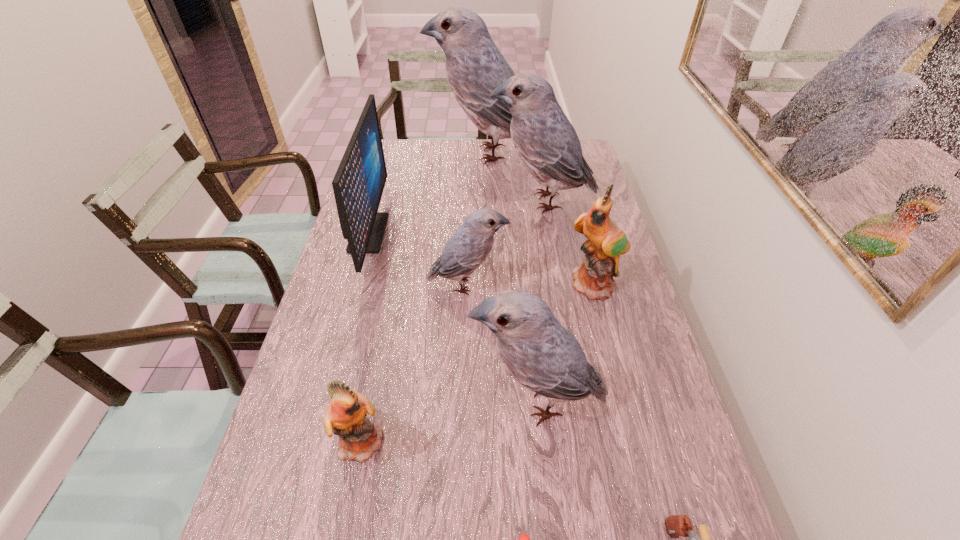
Where is `the farthest object`? The height and width of the screenshot is (540, 960). the farthest object is located at coordinates (474, 66).

Identify the location of the biggest gray parrot. Image resolution: width=960 pixels, height=540 pixels. (474, 66).

Find the location of a particular element. the second farthest parrot is located at coordinates click(545, 140).

The width and height of the screenshot is (960, 540). I want to click on the second biggest gray parrot, so click(545, 140).

You are a GUI agent. You are given a task and a screenshot of the screen. Output one action in this format:
    pyautogui.click(x=<x>, y=<y>)
    Task: Click on the computer monitor
    
    Given the screenshot: What is the action you would take?
    pyautogui.click(x=358, y=184)

Where is `the leftmost object`? the leftmost object is located at coordinates (358, 184).

Identify the location of the right green parrot. The height and width of the screenshot is (540, 960). (606, 241).

Find the location of `the bigger green parrot`. the bigger green parrot is located at coordinates (606, 241).

This screenshot has width=960, height=540. Identify the location of the second smallest gray parrot. (538, 352).

Where is `the nearer green parrot`? the nearer green parrot is located at coordinates (345, 416).